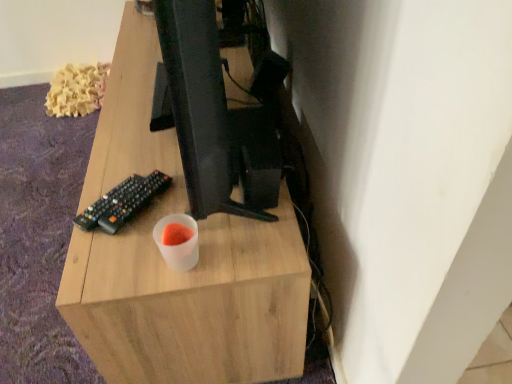
The image size is (512, 384). I want to click on vacant space in front of black plastic remote control at lower left, so click(123, 251).